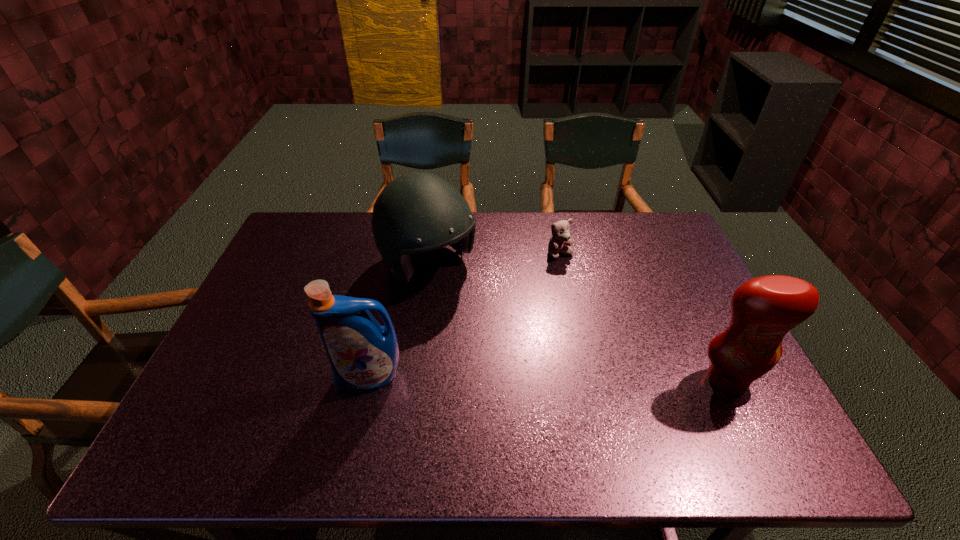
This screenshot has width=960, height=540. Find the location of `free space between the third object from left to right and the rightmost object`. free space between the third object from left to right and the rightmost object is located at coordinates (643, 317).

Where is `vacant space that is in between the rightmost object and the football helmet`? The width and height of the screenshot is (960, 540). vacant space that is in between the rightmost object and the football helmet is located at coordinates (577, 323).

At what (x,y) coordinates should I click in order to perform the action: click on free space that is in between the condiment and the detergent. Please return your answer as a coordinate pair (x, y). This screenshot has width=960, height=540. Looking at the image, I should click on (548, 379).

Locate which object ranks third in proximity to the football helmet. Please provide its 2D coordinates. Your answer should be formatted as a tuple, i.e. [(x, y)], where the tuple contains the x and y coordinates of a point satisfying the conditions above.

[(763, 310)]

I want to click on object that is the second closest one to the teddy bear, so click(x=763, y=310).